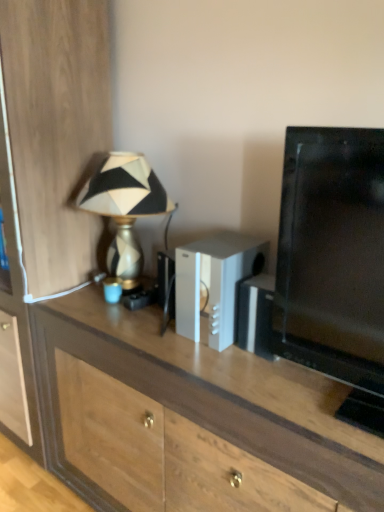
Locate an element on the screen. The image size is (384, 512). gold textured lamp at left is located at coordinates point(124,208).

This screenshot has height=512, width=384. Find the location of `silver metallic speaker at center`. silver metallic speaker at center is located at coordinates (214, 283).

Describe the element at coordinates (189, 419) in the screenshot. I see `wooden desk at center` at that location.

You are a GUI agent. You are given a task and a screenshot of the screen. Output one action in this format:
    pyautogui.click(x=<x>, y=<y>)
    Task: Click on the gold textured lamp at left
    
    Given the screenshot: What is the action you would take?
    pyautogui.click(x=124, y=208)

Identify the location of cabinetry above the wooden desk at center (from a real-world perspective). This screenshot has height=512, width=384. [51, 155].

Which of these two, wooden desk at center or wooden cabinet at left, is wider?

wooden cabinet at left is wider.

Visually, is wooden desk at center positioned to the left or to the right of wooden cabinet at left?

Clearly, wooden desk at center is on the right of wooden cabinet at left in the image.

Which is in front, point (194, 389) or point (98, 68)?

The point (194, 389) is closer to the camera.

Is gold textured lamp at left wider than silver metallic speaker at center?

No.

From a real-world perspective, is gold textured lamp at left positioned over silver metallic speaker at center based on gravity?

Indeed, from a real-world perspective, gold textured lamp at left stands above silver metallic speaker at center.

From the image's perspective, does gold textured lamp at left appear higher than silver metallic speaker at center?

Yes, from the image's perspective, gold textured lamp at left is over silver metallic speaker at center.

Is gold textured lamp at left at the left side of silver metallic speaker at center?

Correct, you'll find gold textured lamp at left to the left of silver metallic speaker at center.

Who is shorter, wooden cabinet at left or silver metallic speaker at center?

silver metallic speaker at center.

Is wooden cabinet at left inside or outside of silver metallic speaker at center?

wooden cabinet at left lies outside silver metallic speaker at center.

Does point (16, 170) lie behind point (253, 272)?

Yes, point (16, 170) is farther from viewer.

Between point (75, 116) and point (52, 401), which one is positioned in front?

Positioned in front is point (75, 116).

From a real-world perspective, between wooden cabinet at left and wooden desk at center, who is vertically higher?

From a 3D spatial view, wooden cabinet at left is above.

Considering the relative sizes of wooden cabinet at left and wooden desk at center in the image provided, is wooden cabinet at left thinner than wooden desk at center?

No, wooden cabinet at left is not thinner than wooden desk at center.

Looking at this image, which of these two, wooden cabinet at left or wooden desk at center, is bigger?

Bigger between the two is wooden cabinet at left.

Between silver metallic speaker at center and gold textured lamp at left, which one has smaller width?

gold textured lamp at left is thinner.

Could you tell me if silver metallic speaker at center is turned towards gold textured lamp at left?

No, silver metallic speaker at center is not facing towards gold textured lamp at left.

From the image's perspective, does silver metallic speaker at center appear lower than gold textured lamp at left?

Indeed, from the image's perspective, silver metallic speaker at center is shown beneath gold textured lamp at left.

Considering the sizes of objects silver metallic speaker at center and gold textured lamp at left in the image provided, who is smaller, silver metallic speaker at center or gold textured lamp at left?

silver metallic speaker at center.

Could you tell me if wooden cabinet at left is facing gold textured lamp at left?

No, wooden cabinet at left is not oriented towards gold textured lamp at left.

Which object is thinner, wooden cabinet at left or gold textured lamp at left?

gold textured lamp at left.

Does wooden cabinet at left appear on the left side of gold textured lamp at left?

Correct, you'll find wooden cabinet at left to the left of gold textured lamp at left.

The height and width of the screenshot is (512, 384). What are the coordinates of `appliance located on the right of wooden cabinet at left` in the screenshot? It's located at (214, 283).

From the image's perspective, is silver metallic speaker at center above wooden cabinet at left?

No, from the image's perspective, silver metallic speaker at center is not on top of wooden cabinet at left.

Is silver metallic speaker at center positioned beyond the bounds of wooden cabinet at left?

Yes, silver metallic speaker at center is outside of wooden cabinet at left.

Which object is thinner, silver metallic speaker at center or wooden cabinet at left?

Thinner between the two is silver metallic speaker at center.

Image resolution: width=384 pixels, height=512 pixels. I want to click on desk beneath the wooden cabinet at left (from a real-world perspective), so click(x=189, y=419).

The width and height of the screenshot is (384, 512). I want to click on lamp that appears above the silver metallic speaker at center (from a real-world perspective), so click(124, 208).

Looking at this image, when comparing their distances from wooden desk at center, does wooden cabinet at left or silver metallic speaker at center seem closer?

Based on the image, silver metallic speaker at center appears to be nearer to wooden desk at center.

Estimate the real-world distances between objects in this image. Which object is closer to silver metallic speaker at center, wooden desk at center or gold textured lamp at left?

Among the two, wooden desk at center is located nearer to silver metallic speaker at center.

Which object lies further to the anchor point wooden desk at center, wooden cabinet at left or gold textured lamp at left?

gold textured lamp at left lies further to wooden desk at center than the other object.

When comparing their distances from silver metallic speaker at center, does gold textured lamp at left or wooden desk at center seem closer?

The object closer to silver metallic speaker at center is wooden desk at center.

Which object lies nearer to the anchor point silver metallic speaker at center, wooden cabinet at left or gold textured lamp at left?

The object closer to silver metallic speaker at center is gold textured lamp at left.

Which object lies nearer to the anchor point gold textured lamp at left, wooden desk at center or silver metallic speaker at center?

Based on the image, silver metallic speaker at center appears to be nearer to gold textured lamp at left.

From the picture: Estimate the real-world distances between objects in this image. Which object is closer to wooden desk at center, gold textured lamp at left or wooden cabinet at left?

Among the two, wooden cabinet at left is located nearer to wooden desk at center.

Looking at the image, which one is located closer to wooden cabinet at left, gold textured lamp at left or silver metallic speaker at center?

gold textured lamp at left.

Identify the location of desk located between wooden cabinet at left and silver metallic speaker at center in the left-right direction. (189, 419).

Where is `appliance that lies between gold textured lamp at left and wooden desk at center from top to bottom`? The width and height of the screenshot is (384, 512). appliance that lies between gold textured lamp at left and wooden desk at center from top to bottom is located at coordinates (214, 283).

I want to click on lamp that lies between wooden cabinet at left and wooden desk at center from top to bottom, so click(x=124, y=208).

Where is `lamp between wooden cabinet at left and silver metallic speaker at center`? This screenshot has width=384, height=512. lamp between wooden cabinet at left and silver metallic speaker at center is located at coordinates (124, 208).